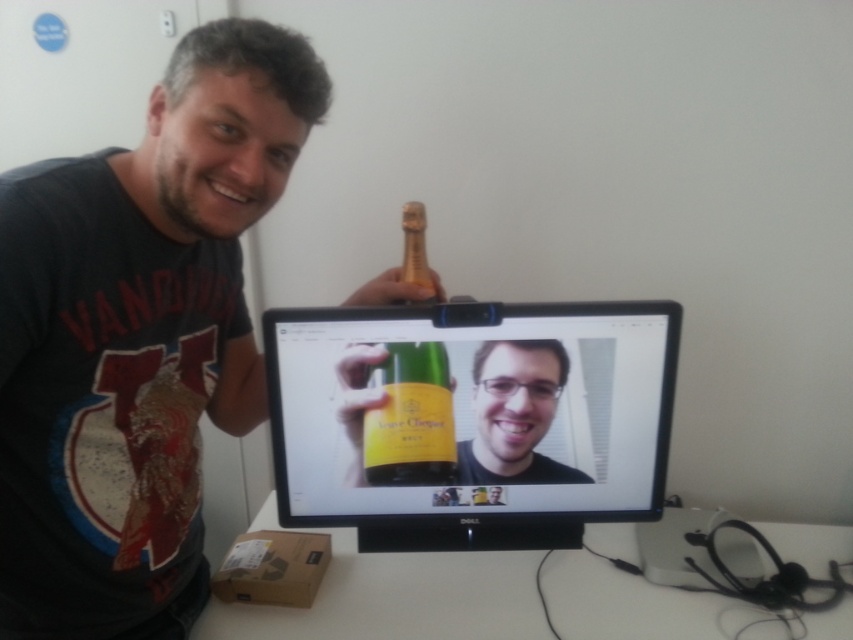
Question: Is clear glass bottle at center in front of green glass bottle at center?

Choices:
 (A) no
 (B) yes

Answer: (B)

Question: Which of these objects is positioned closest to the clear glass bottle at center?

Choices:
 (A) white matte table at lower center
 (B) green glass bottle at center

Answer: (B)

Question: Considering the real-world distances, which object is farthest from the matte black t-shirt at left?

Choices:
 (A) clear glass bottle at center
 (B) green glass bottle at center
 (C) gold textured champagne bottle at center

Answer: (C)

Question: Can you confirm if white matte table at lower center is wider than green glass bottle at center?

Choices:
 (A) yes
 (B) no

Answer: (A)

Question: From the image, what is the correct spatial relationship of white matte table at lower center in relation to gold textured champagne bottle at center?

Choices:
 (A) above
 (B) below

Answer: (B)

Question: Which of these objects is positioned closest to the matte black t-shirt at left?

Choices:
 (A) green glass bottle at center
 (B) white matte table at lower center
 (C) clear glass bottle at center
 (D) gold textured champagne bottle at center

Answer: (C)